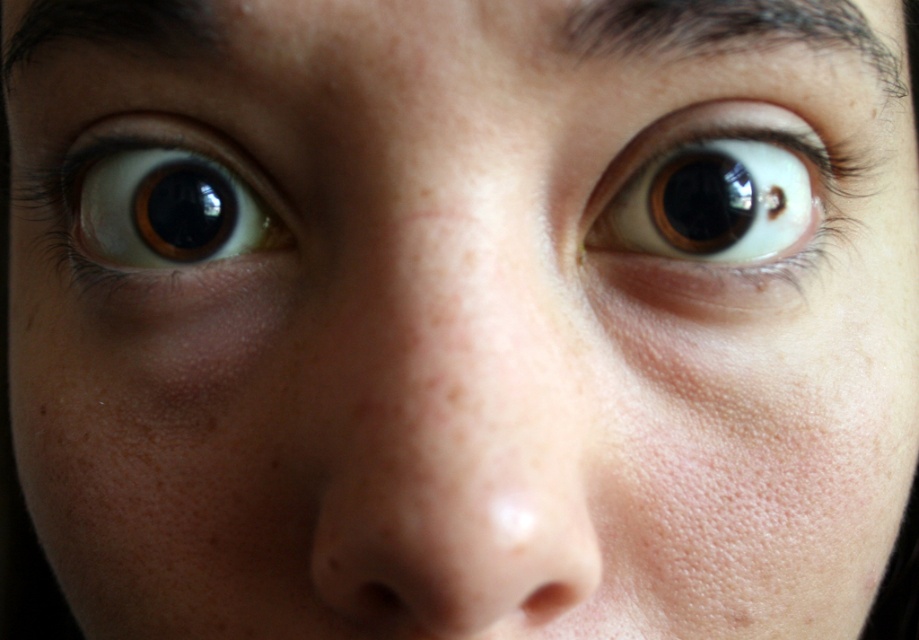
You are a photographer adjusting your camera settings. You notice two points in the image at coordinates point (645,4) and point (213,29). Which point is nearer to the camera lens?

Point (645,4) is closer to the camera than point (213,29).

You are a photographer adjusting the lighting for a portrait. You notice the dark brown hair at upper center and the dark brown hair at upper left in the frame. Which hair strand is positioned lower in the image?

The dark brown hair at upper center is positioned lower than the dark brown hair at upper left.

You are a photographer adjusting the focus on your camera. You notice the brown glossy eye at upper right and the dark brown hair at upper left in your viewfinder. Which object should you focus on first if you want to ensure the taller one is in sharp focus?

The brown glossy eye at upper right has a greater height compared to the dark brown hair at upper left, so you should focus on the brown glossy eye at upper right first to ensure the taller one is in sharp focus.